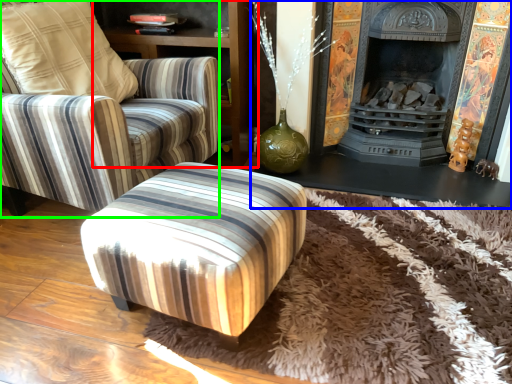
Question: Estimate the real-world distances between objects in this image. Which object is closer to dresser (highlighted by a red box), fireplace (highlighted by a blue box) or chair (highlighted by a green box)?

Choices:
 (A) fireplace
 (B) chair

Answer: (B)